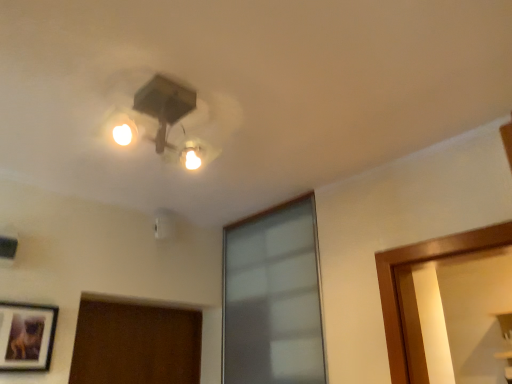
Locate an element on the screen. The height and width of the screenshot is (384, 512). matte black picture frame at lower left is located at coordinates (26, 336).

Does matte black fixture at upper center have a greater height compared to matte black picture frame at lower left?

In fact, matte black fixture at upper center may be shorter than matte black picture frame at lower left.

Where is `lamp located on the right of matte black picture frame at lower left`? Image resolution: width=512 pixels, height=384 pixels. lamp located on the right of matte black picture frame at lower left is located at coordinates (158, 115).

Which is in front, matte black fixture at upper center or matte black picture frame at lower left?

matte black fixture at upper center is closer to the camera.

From the image's perspective, which one is positioned higher, matte black fixture at upper center or matte black picture frame at lower left?

matte black fixture at upper center appears higher in the image.

Looking at their sizes, would you say matte black fixture at upper center is wider or thinner than frosted glass window at center?

matte black fixture at upper center is wider than frosted glass window at center.

Are matte black fixture at upper center and frosted glass window at center located far from each other?

No.

Is matte black fixture at upper center positioned in front of frosted glass window at center?

Yes, matte black fixture at upper center is closer to the viewer.

In the scene shown: Who is shorter, matte black fixture at upper center or frosted glass window at center?

matte black fixture at upper center is shorter.

From a real-world perspective, which object stands above the other?

frosted glass window at center is physically above.

Can you confirm if frosted glass window at center is shorter than matte black picture frame at lower left?

In fact, frosted glass window at center may be taller than matte black picture frame at lower left.

How distant is frosted glass window at center from matte black picture frame at lower left?

frosted glass window at center is 3.31 feet away from matte black picture frame at lower left.

Does point (280, 241) lie behind point (23, 351)?

Yes.

From the picture: Is matte black picture frame at lower left not within frosted glass window at center?

Yes.

Between matte black picture frame at lower left and frosted glass window at center, which one has larger size?

frosted glass window at center is bigger.

Considering the relative positions of matte black picture frame at lower left and frosted glass window at center in the image provided, is matte black picture frame at lower left to the left or to the right of frosted glass window at center?

In the image, matte black picture frame at lower left appears on the left side of frosted glass window at center.

Is matte black picture frame at lower left positioned with its back to matte black fixture at upper center?

No.

What are the coordinates of `picture frame below the matte black fixture at upper center (from the image's perspective)` in the screenshot? It's located at (26, 336).

Which point is more forward, (45, 318) or (118, 96)?

Positioned in front is point (118, 96).

Based on their sizes in the image, would you say frosted glass window at center is bigger or smaller than matte black fixture at upper center?

Considering their sizes, frosted glass window at center takes up more space than matte black fixture at upper center.

Based on the photo, who is more distant, frosted glass window at center or matte black fixture at upper center?

frosted glass window at center is further away from the camera.

Locate an element on the screen. lamp on the left of the frosted glass window at center is located at coordinates (158, 115).

You are a GUI agent. You are given a task and a screenshot of the screen. Output one action in this format:
    pyautogui.click(x=<x>, y=<y>)
    Task: Click on the lamp that is above the matte black picture frame at lower left (from the image's perspective)
    This screenshot has height=384, width=512.
    Given the screenshot: What is the action you would take?
    pyautogui.click(x=158, y=115)

At what (x,y) coordinates should I click in order to perform the action: click on window lying below the matte black fixture at upper center (from the image's perspective). Please return your answer as a coordinate pair (x, y). This screenshot has height=384, width=512. Looking at the image, I should click on (273, 298).

Consider the image. Looking at the image, which one is located closer to matte black picture frame at lower left, matte black fixture at upper center or frosted glass window at center?

Among the two, matte black fixture at upper center is located nearer to matte black picture frame at lower left.

When comparing their distances from matte black picture frame at lower left, does frosted glass window at center or matte black fixture at upper center seem further?

frosted glass window at center lies further to matte black picture frame at lower left than the other object.

From the image, which object appears to be nearer to matte black fixture at upper center, matte black picture frame at lower left or frosted glass window at center?

frosted glass window at center lies closer to matte black fixture at upper center than the other object.

Based on their spatial positions, is frosted glass window at center or matte black picture frame at lower left closer to matte black fixture at upper center?

frosted glass window at center is closer to matte black fixture at upper center.

Estimate the real-world distances between objects in this image. Which object is closer to frosted glass window at center, matte black fixture at upper center or matte black picture frame at lower left?

The object closer to frosted glass window at center is matte black fixture at upper center.

From the image, which object appears to be farther from frosted glass window at center, matte black picture frame at lower left or matte black fixture at upper center?

Based on the image, matte black picture frame at lower left appears to be further to frosted glass window at center.

Where is `lamp between matte black picture frame at lower left and frosted glass window at center`? The image size is (512, 384). lamp between matte black picture frame at lower left and frosted glass window at center is located at coordinates (158, 115).